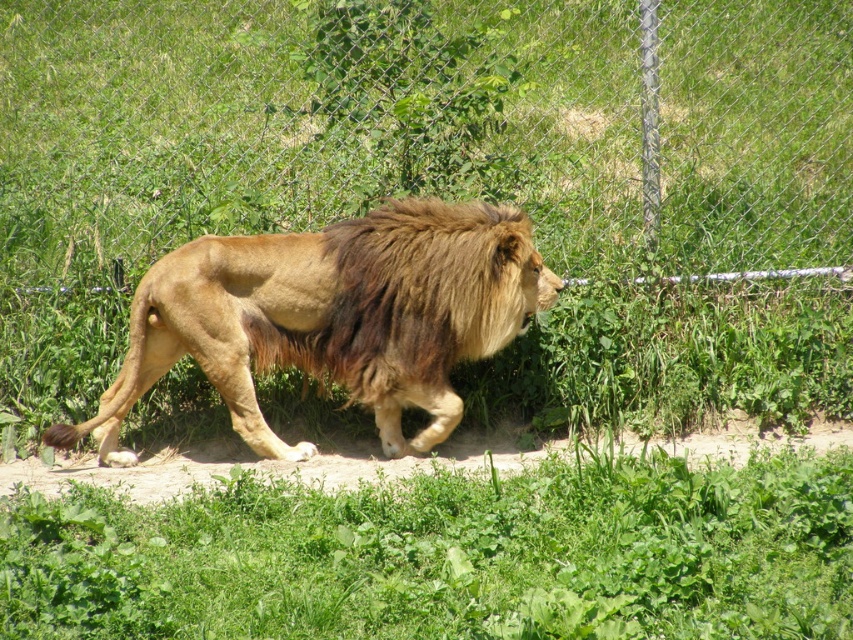
Locate an element on the screen. metallic chain-link fence at center is located at coordinates (427, 125).

Is point (56, 4) less distant than point (469, 228)?

No, (56, 4) is further to viewer.

Is point (479, 40) positioned before point (422, 282)?

No.

Where is `metallic chain-link fence at center`? metallic chain-link fence at center is located at coordinates (427, 125).

How far apart are golden fur lion at center and brown fuzzy mane at center?

golden fur lion at center and brown fuzzy mane at center are 10.31 centimeters apart.

Is point (497, 216) less distant than point (447, 326)?

Yes, it is in front of point (447, 326).

Which is behind, point (445, 326) or point (451, 237)?

The point (445, 326) is more distant.

The width and height of the screenshot is (853, 640). In order to click on golden fur lion at center in this screenshot , I will do `click(334, 317)`.

Who is shorter, green leafy grass at lower center or brown fuzzy mane at center?

green leafy grass at lower center

Who is positioned more to the left, green leafy grass at lower center or brown fuzzy mane at center?

brown fuzzy mane at center is more to the left.

Who is more forward, (280, 598) or (374, 272)?

Point (280, 598) is in front.

Find the location of a particular element. The width and height of the screenshot is (853, 640). green leafy grass at lower center is located at coordinates (447, 556).